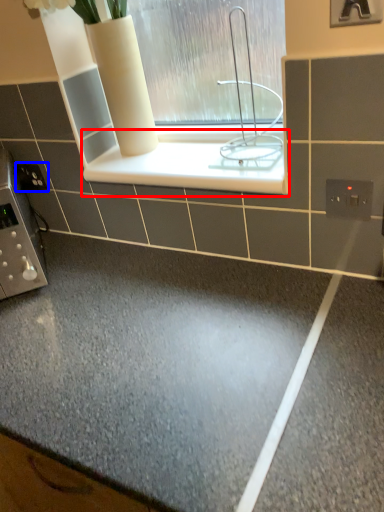
Question: Which object appears closest to the camera in this image, ledge (highlighted by a red box) or electric outlet (highlighted by a blue box)?

Choices:
 (A) ledge
 (B) electric outlet

Answer: (A)